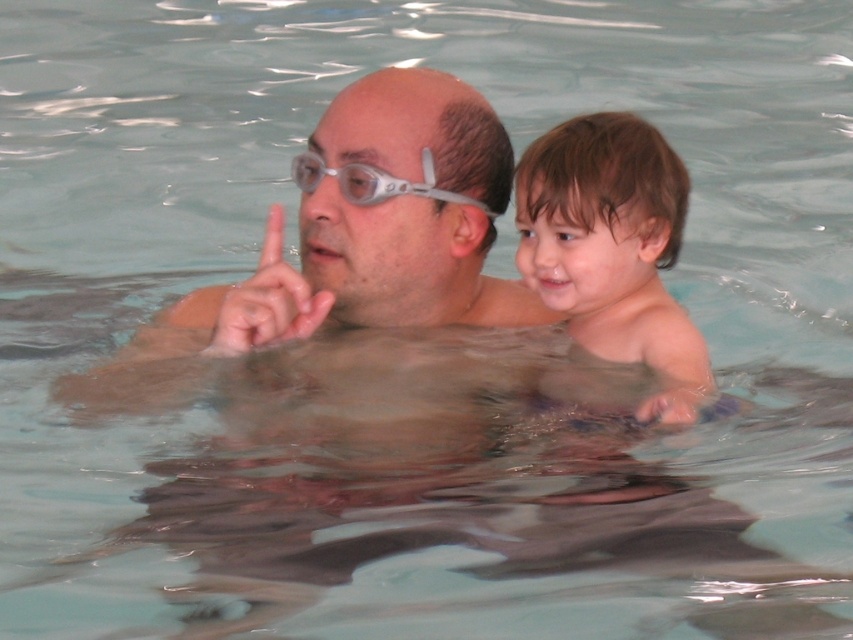
What is the color and texture of the hair located at the point marked by coordinates (613, 250) in the image?

The hair at point (613, 250) is brown and matte.

You are a lifeguard observing the pool area. You notice the brown matte hair at upper right and the clear plastic goggles at upper center. Which object is closer to the front of the pool area?

The brown matte hair at upper right is in front of the clear plastic goggles at upper center, so it is closer to the front of the pool area.

You are a lifeguard observing the scene. You notice the brown matte hair at upper right and the clear plastic goggles at upper center. Which object appears narrower in the image?

The brown matte hair at upper right has a lesser width compared to the clear plastic goggles at upper center, so the brown matte hair at upper right appears narrower.